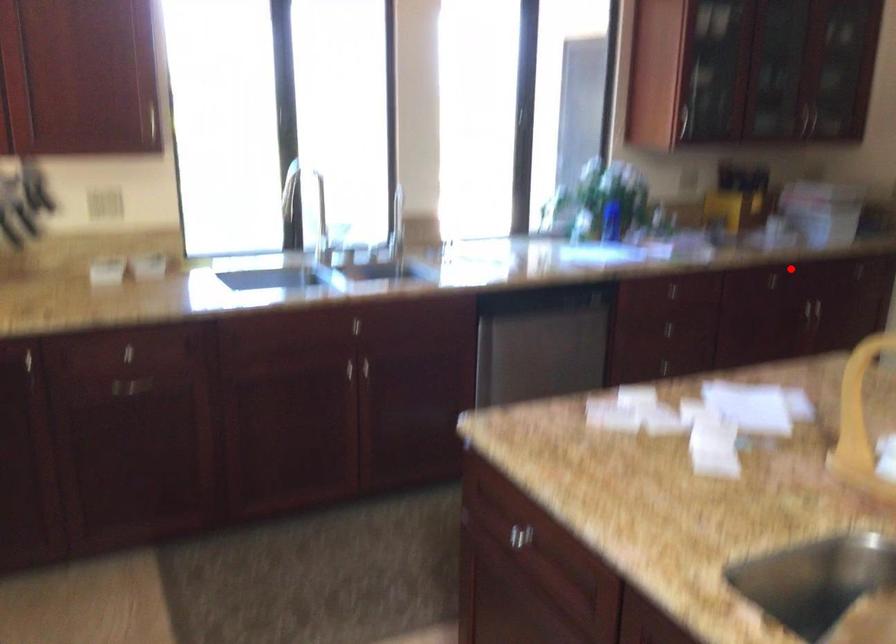
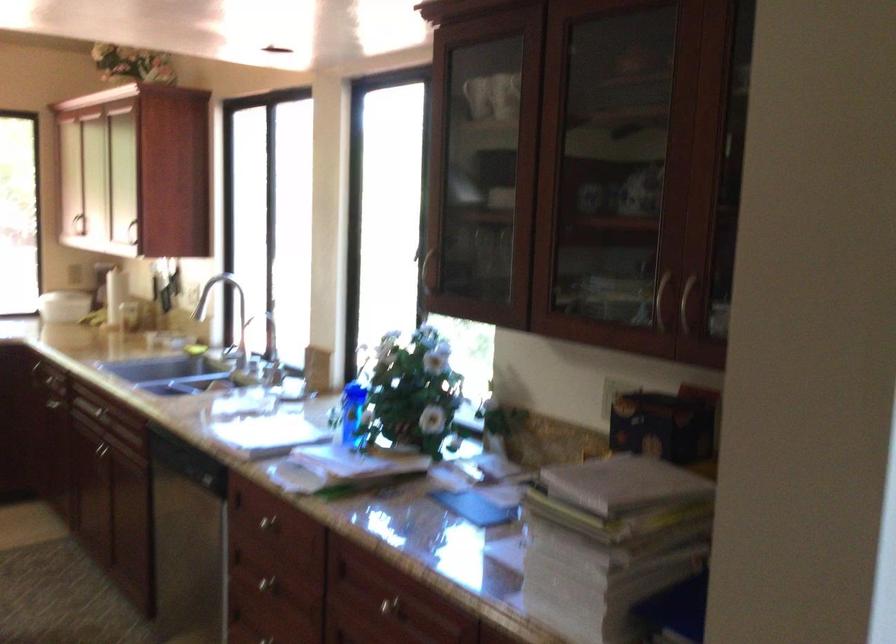
Locate, in the second image, the point that corresponds to the highlighted location in the first image.

(386, 605)